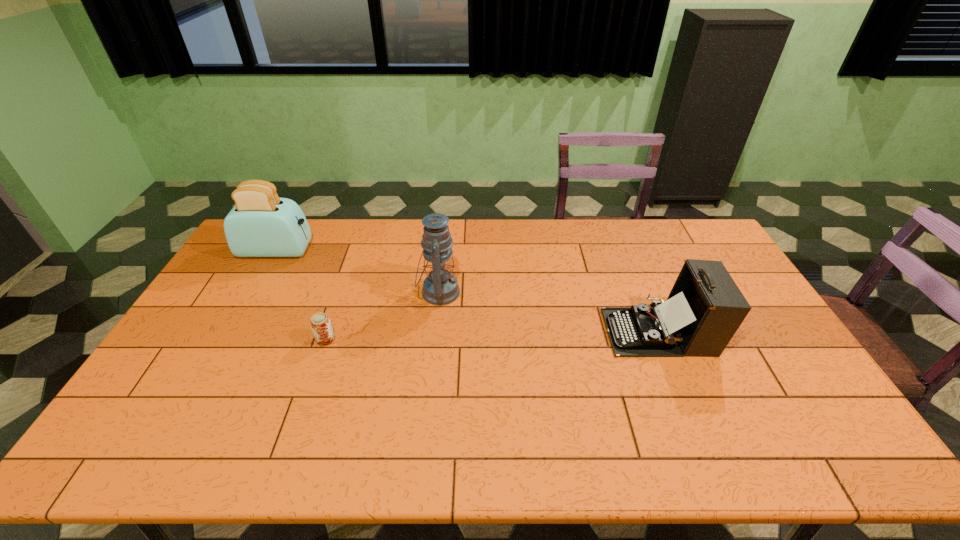
Select which object appears as the closest to the shortest object. Please provide its 2D coordinates. Your answer should be formatted as a tuple, i.e. [(x, y)], where the tuple contains the x and y coordinates of a point satisfying the conditions above.

[(440, 287)]

Identify the location of object identified as the closest to the farthest object. The width and height of the screenshot is (960, 540). (320, 323).

Where is `free space that satisfies the following two spatial constraints: 1. on the side of the beer can with the lever; 2. on the left side of the farthest object`? free space that satisfies the following two spatial constraints: 1. on the side of the beer can with the lever; 2. on the left side of the farthest object is located at coordinates (227, 339).

This screenshot has height=540, width=960. I want to click on free space that satisfies the following two spatial constraints: 1. on the side of the shortest object with the lever; 2. on the left side of the farthest object, so click(227, 339).

Where is `vacant space that satisfies the following two spatial constraints: 1. on the side of the shortest object with the lever; 2. on the left side of the farthest object`? This screenshot has height=540, width=960. vacant space that satisfies the following two spatial constraints: 1. on the side of the shortest object with the lever; 2. on the left side of the farthest object is located at coordinates (227, 339).

Locate an element on the screen. The width and height of the screenshot is (960, 540). free space in the image that satisfies the following two spatial constraints: 1. inside the open case of the typewriter; 2. on the front side of the shortest object is located at coordinates (662, 339).

You are a GUI agent. You are given a task and a screenshot of the screen. Output one action in this format:
    pyautogui.click(x=<x>, y=<y>)
    Task: Click on the free space that satisfies the following two spatial constraints: 1. on the side of the leftmost object with the lever; 2. on the left side of the second object from left to right
    The width and height of the screenshot is (960, 540).
    Given the screenshot: What is the action you would take?
    pyautogui.click(x=227, y=339)

This screenshot has height=540, width=960. Find the location of `vacant space that satisfies the following two spatial constraints: 1. inside the open case of the rightmost object; 2. on the front side of the beer can`. vacant space that satisfies the following two spatial constraints: 1. inside the open case of the rightmost object; 2. on the front side of the beer can is located at coordinates (662, 339).